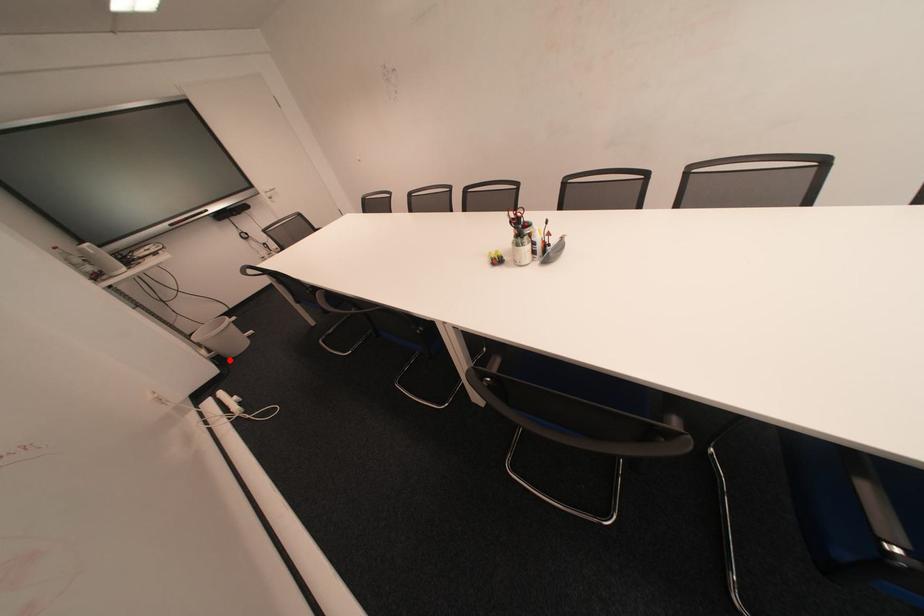
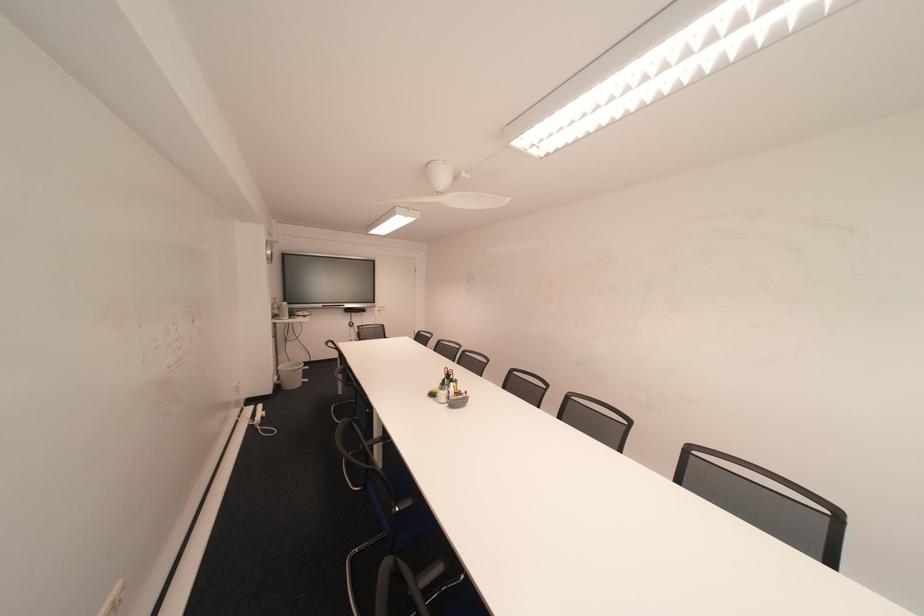
Question: A red point is marked in image1. In image2, is the corresponding 3D point closer to the camera or farther? Reply with the corresponding letter.

Choices:
 (A) The corresponding 3D point is closer.
 (B) The corresponding 3D point is farther.

Answer: (B)